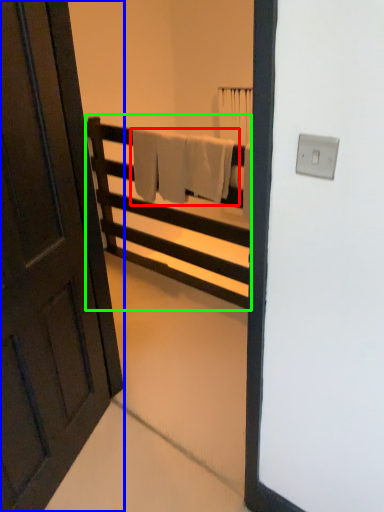
Question: Estimate the real-world distances between objects in this image. Which object is closer to bath towel (highlighted by a red box), door (highlighted by a blue box) or furniture (highlighted by a green box)?

Choices:
 (A) door
 (B) furniture

Answer: (B)